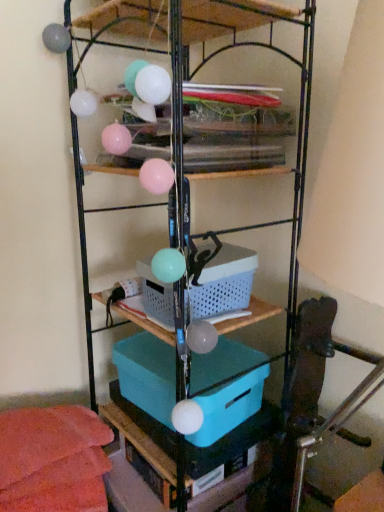
Question: Does plastic/mesh basket at center have a lesser height compared to blue plastic basket at center?

Choices:
 (A) yes
 (B) no

Answer: (A)

Question: Are plastic/mesh basket at center and blue plastic basket at center far apart?

Choices:
 (A) no
 (B) yes

Answer: (A)

Question: Does plastic/mesh basket at center have a greater height compared to blue plastic basket at center?

Choices:
 (A) no
 (B) yes

Answer: (A)

Question: Is plastic/mesh basket at center positioned with its back to blue plastic basket at center?

Choices:
 (A) yes
 (B) no

Answer: (A)

Question: Is plastic/mesh basket at center not inside blue plastic basket at center?

Choices:
 (A) yes
 (B) no

Answer: (B)

Question: Is plastic/mesh basket at center oriented towards blue plastic basket at center?

Choices:
 (A) no
 (B) yes

Answer: (B)

Question: Does teal plastic box at center have a larger size compared to plastic/mesh basket at center?

Choices:
 (A) yes
 (B) no

Answer: (A)

Question: Does teal plastic box at center have a smaller size compared to plastic/mesh basket at center?

Choices:
 (A) no
 (B) yes

Answer: (A)

Question: Does teal plastic box at center lie behind plastic/mesh basket at center?

Choices:
 (A) yes
 (B) no

Answer: (A)

Question: Considering the relative sizes of teal plastic box at center and plastic/mesh basket at center in the image provided, is teal plastic box at center taller than plastic/mesh basket at center?

Choices:
 (A) no
 (B) yes

Answer: (B)

Question: From the image's perspective, is teal plastic box at center under plastic/mesh basket at center?

Choices:
 (A) yes
 (B) no

Answer: (A)

Question: From a real-world perspective, is teal plastic box at center located higher than plastic/mesh basket at center?

Choices:
 (A) no
 (B) yes

Answer: (A)

Question: Can you confirm if blue plastic basket at center is wider than plastic/mesh basket at center?

Choices:
 (A) no
 (B) yes

Answer: (B)